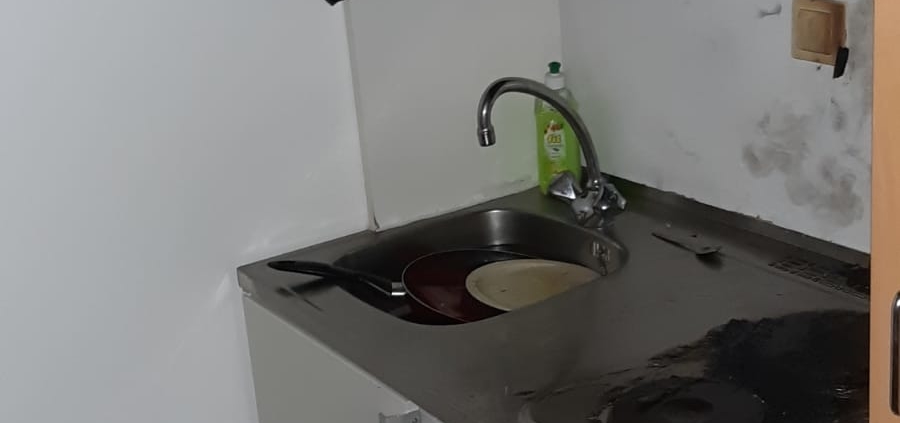
Locate an element on the screen. The image size is (900, 423). white plate is located at coordinates (508, 291).